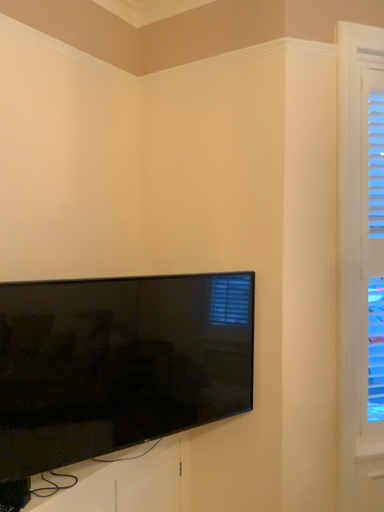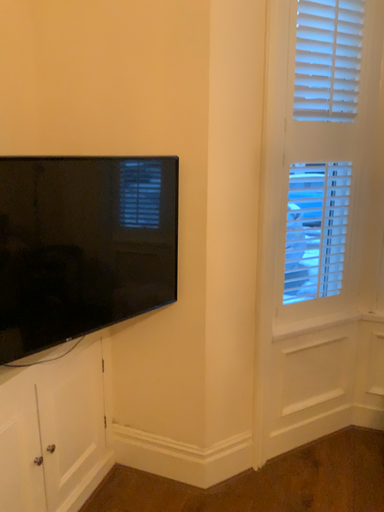
Question: Which way did the camera rotate in the video?

Choices:
 (A) rotated left
 (B) rotated right

Answer: (B)